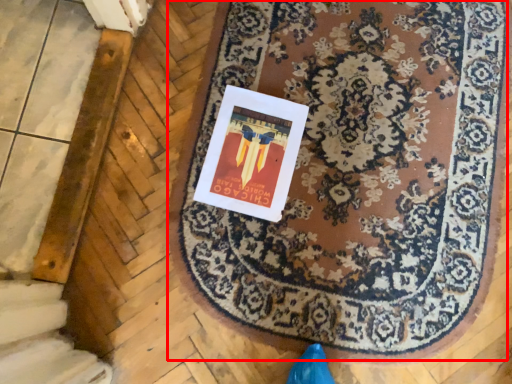
Question: From the image's perspective, considering the relative positions of mat (annotated by the red box) and postcard in the image provided, where is mat (annotated by the red box) located with respect to the staircase?

Choices:
 (A) above
 (B) below

Answer: (B)